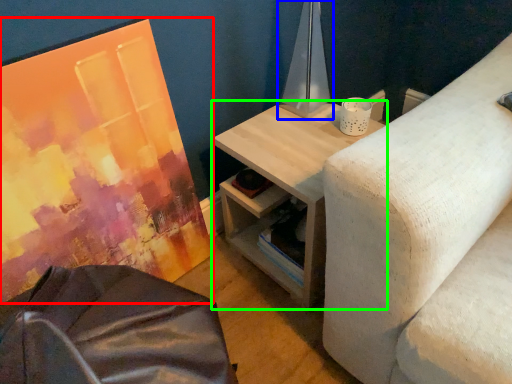
Question: Which object is the farthest from canvas (highlighted by a red box)? Choose among these: table lamp (highlighted by a blue box) or table (highlighted by a green box).

Choices:
 (A) table lamp
 (B) table

Answer: (A)